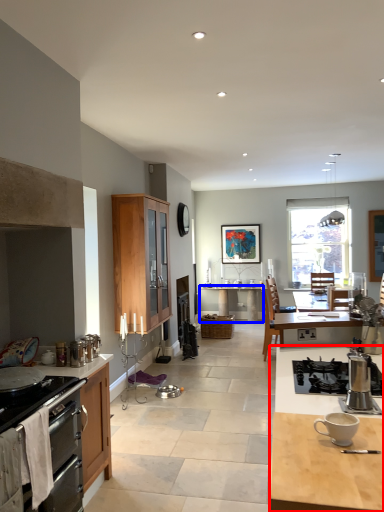
Question: Which object is further to the camera taking this photo, desk (highlighted by a red box) or desk (highlighted by a blue box)?

Choices:
 (A) desk
 (B) desk

Answer: (B)